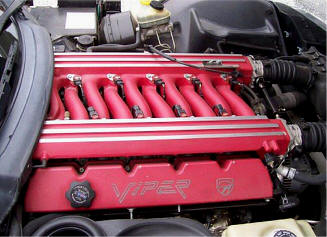
In order to click on cord in this screenshot , I will do `click(297, 176)`.